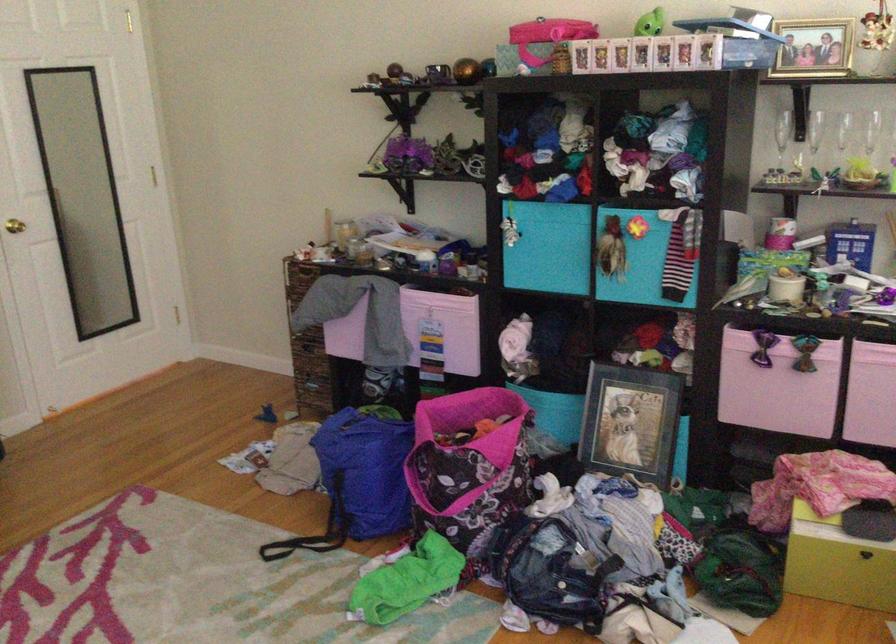
This screenshot has width=896, height=644. Find the location of `white jar lid`. white jar lid is located at coordinates (786, 289).